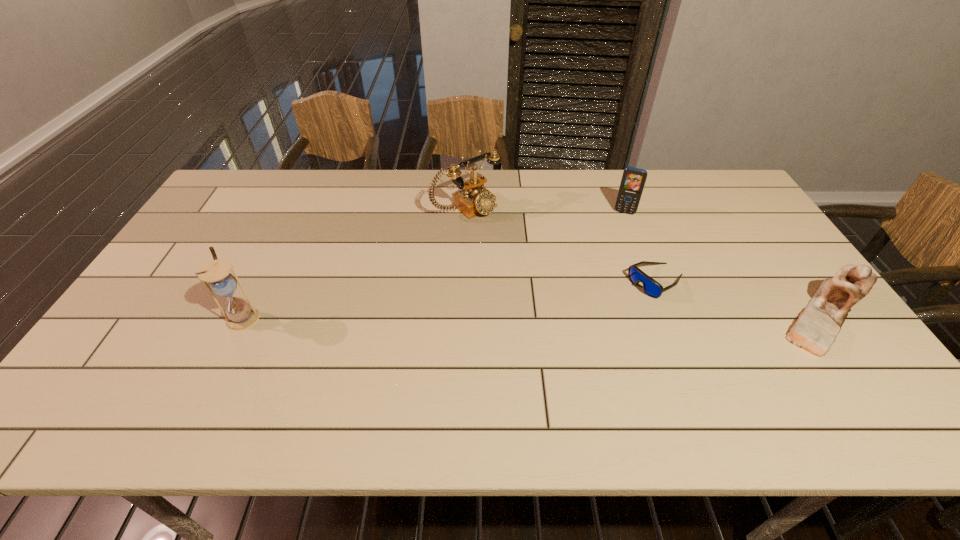
At what (x,y) coordinates should I click in order to perform the action: click on object that is at the near edge. Please return your answer as a coordinate pair (x, y). Looking at the image, I should click on (815, 330).

Identify the location of object that is at the right edge. This screenshot has width=960, height=540. 815,330.

This screenshot has width=960, height=540. I want to click on object that is at the near right corner, so click(x=815, y=330).

At what (x,y) coordinates should I click in order to perform the action: click on vacant point at the far edge. Please return your answer as a coordinate pair (x, y). This screenshot has height=540, width=960. Looking at the image, I should click on (678, 178).

The height and width of the screenshot is (540, 960). In the image, there is a desktop. What are the coordinates of `vacant space at the near edge` in the screenshot? It's located at (333, 356).

You are a GUI agent. You are given a task and a screenshot of the screen. Output one action in this format:
    pyautogui.click(x=<x>, y=<y>)
    Task: Click on the free region at the left edge of the desktop
    
    Given the screenshot: What is the action you would take?
    pyautogui.click(x=229, y=243)

Identify the location of vacant space at the right edge of the desktop. The image size is (960, 540). (782, 343).

You are a GUI agent. You are given a task and a screenshot of the screen. Output one action in this format:
    pyautogui.click(x=<x>, y=<y>)
    Task: Click on the vacant area at the far left corner of the desktop
    The image size is (960, 540).
    Given the screenshot: What is the action you would take?
    pyautogui.click(x=224, y=188)

The image size is (960, 540). Find the location of `vacant point located between the cellular telephone and the rightmost object`. vacant point located between the cellular telephone and the rightmost object is located at coordinates (725, 264).

Locate an element on the screen. This screenshot has width=960, height=540. unoccupied position between the sunglasses and the fourth object from right to left is located at coordinates (562, 245).